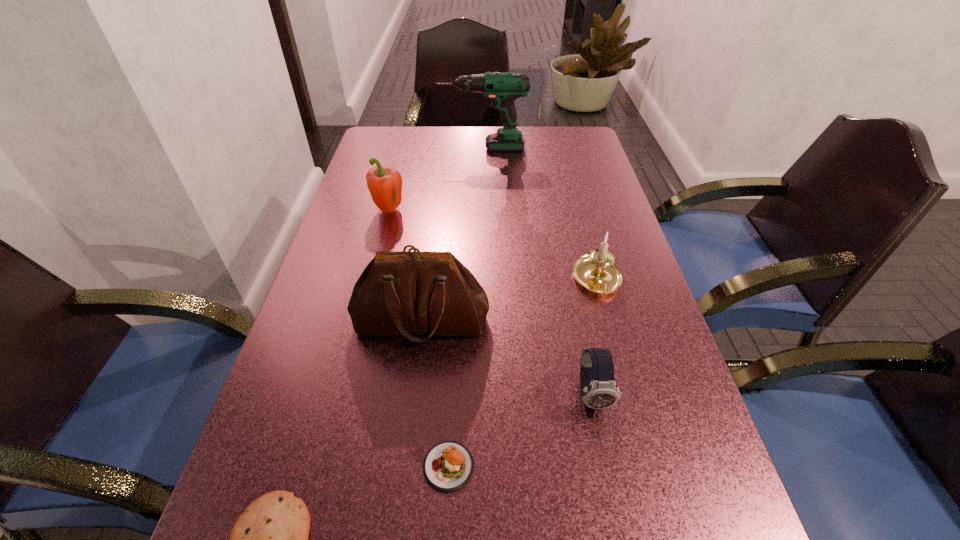
Find the location of a particular element. The height and width of the screenshot is (540, 960). the farthest object is located at coordinates coord(502,88).

Where is `the tallest object`? This screenshot has height=540, width=960. the tallest object is located at coordinates (502, 88).

Where is `the sixth shortest object`? the sixth shortest object is located at coordinates (409, 293).

Image resolution: width=960 pixels, height=540 pixels. I want to click on pepper, so click(385, 184).

The width and height of the screenshot is (960, 540). I want to click on the fourth tallest object, so click(597, 272).

Locate an element on the screen. Image resolution: width=960 pixels, height=540 pixels. the fifth farthest object is located at coordinates (598, 389).

Where is `watch`? The image size is (960, 540). watch is located at coordinates (598, 389).

Find the location of a particular element. The image size is (960, 540). patty (food) is located at coordinates (448, 466).

In order to click on free space located 0.170m on the handle side of the tallest object in this screenshot , I will do `click(389, 148)`.

This screenshot has height=540, width=960. I want to click on vacant space located 0.110m on the handle side of the tallest object, so click(407, 148).